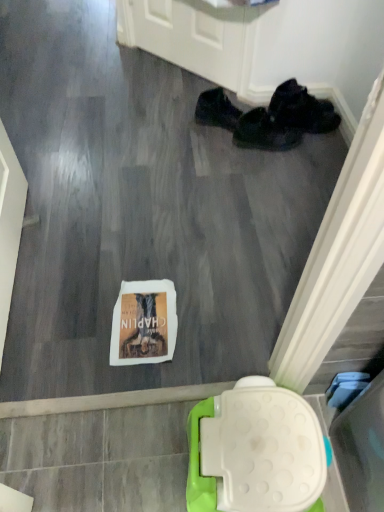
You are a GUI agent. You are given a task and a screenshot of the screen. Output one action in this format:
    pyautogui.click(x=<x>, y=<y>)
    Task: Click on the free point to the right of black fabric shoes at center, positioned as the 2th footwear in right-to-left order
    The width and height of the screenshot is (384, 512).
    Given the screenshot: What is the action you would take?
    pyautogui.click(x=313, y=153)